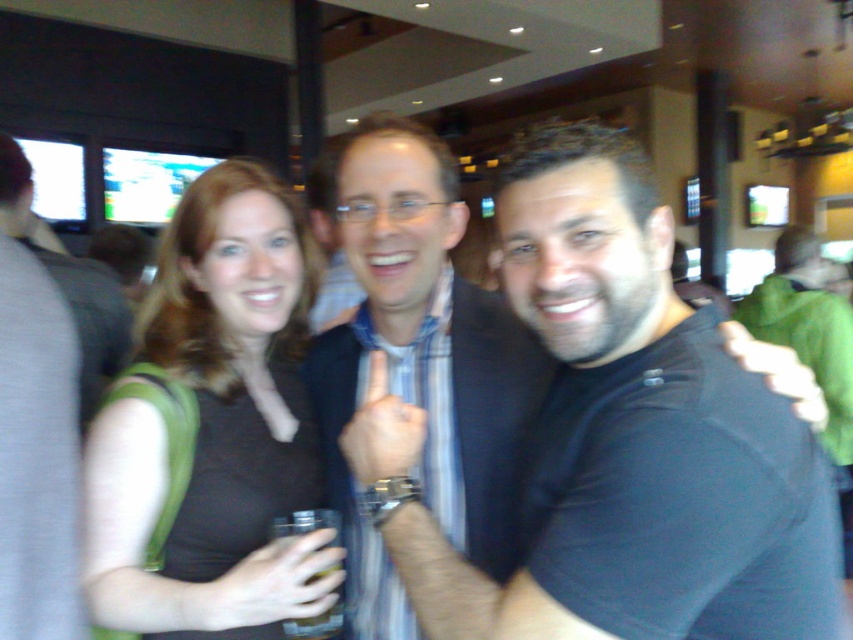
Between black shirt at center and matte black shirt at center, which one has less height?

black shirt at center

Does black shirt at center have a greater width compared to matte black shirt at center?

Yes.

Between point (621, 396) and point (254, 164), which one is positioned in front?

Point (621, 396) is in front.

The image size is (853, 640). Find the location of `black shirt at center`. black shirt at center is located at coordinates (593, 419).